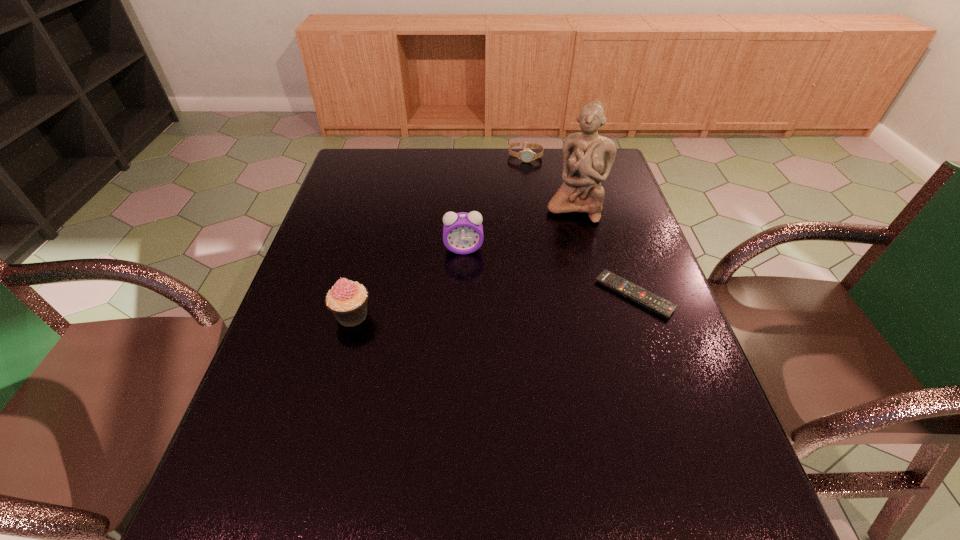
What are the coordinates of `vacant point located between the farthest object and the fourth object from right to left` in the screenshot? It's located at (494, 202).

Locate an element on the screen. This screenshot has height=540, width=960. free spot between the alarm clock and the fourth nearest object is located at coordinates (519, 228).

What are the coordinates of `vacant area between the shortest object and the fourth tallest object` in the screenshot? It's located at (580, 226).

Locate an element on the screen. The width and height of the screenshot is (960, 540). free spot between the alarm clock and the second farthest object is located at coordinates (519, 228).

This screenshot has height=540, width=960. What are the coordinates of `empty location between the cupcake and the watch` in the screenshot? It's located at (439, 236).

Where is `vacant space in between the leftmost object and the second object from left to right`? vacant space in between the leftmost object and the second object from left to right is located at coordinates (408, 282).

The image size is (960, 540). I want to click on empty space that is in between the tallest object and the cupcake, so click(464, 261).

Where is `unoccupied area between the remote control and the third nearest object`? unoccupied area between the remote control and the third nearest object is located at coordinates (549, 272).

Identify the location of free area in between the fourth nearest object and the second object from left to right. This screenshot has height=540, width=960. [519, 228].

Where is `object that ranks as the closest to the fourth nearest object`? The image size is (960, 540). object that ranks as the closest to the fourth nearest object is located at coordinates (526, 155).